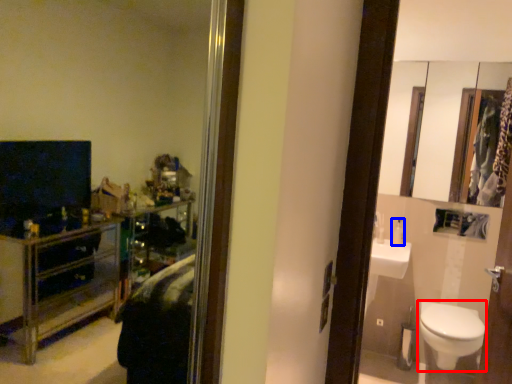
Question: Which of the following is the closest to the observer, toilet (highlighted by a red box) or toiletry (highlighted by a blue box)?

Choices:
 (A) toilet
 (B) toiletry

Answer: (A)